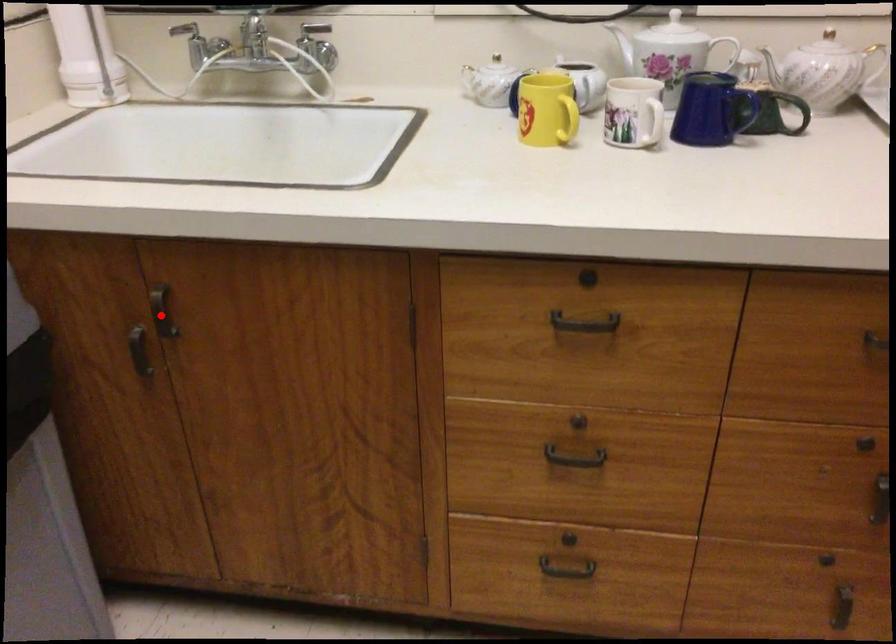
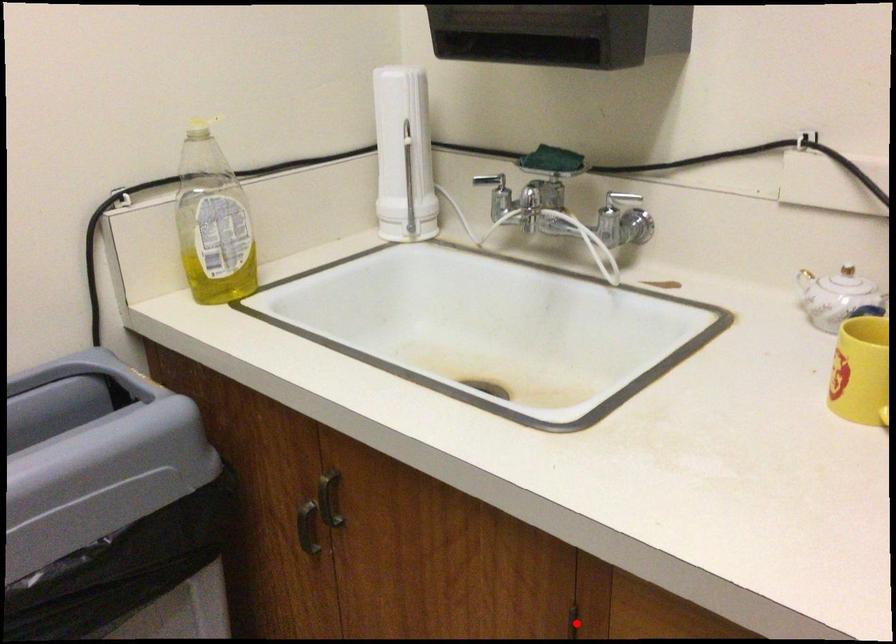
I am providing you with two images of the same scene from different viewpoints. A red point is marked on the first image and another point is marked on the second image. Are the points marked in image1 and image2 representing the same 3D position?

No